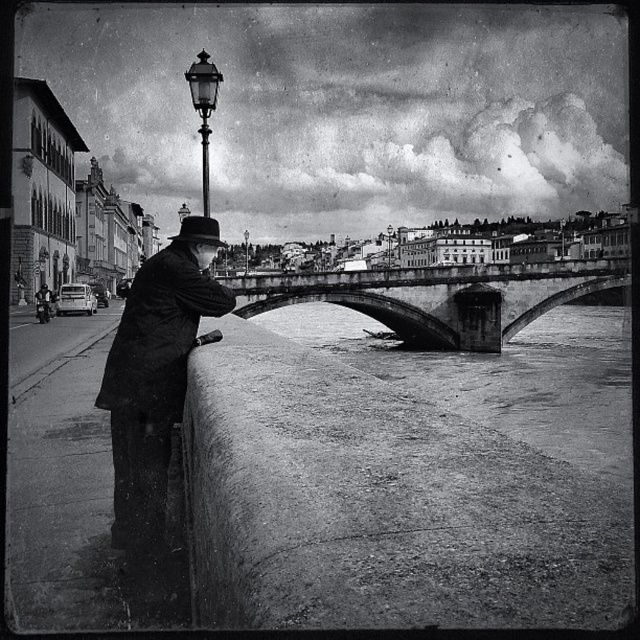
Is dark matte coat at left to the right of polished brass streetlamp at upper center from the viewer's perspective?

Indeed, dark matte coat at left is positioned on the right side of polished brass streetlamp at upper center.

Between dark matte coat at left and polished brass streetlamp at upper center, which one has more height?

Standing taller between the two is polished brass streetlamp at upper center.

Image resolution: width=640 pixels, height=640 pixels. I want to click on dark matte coat at left, so click(160, 336).

Does rough concrete river at center appear under dark matte coat at left?

Indeed, rough concrete river at center is positioned under dark matte coat at left.

Between rough concrete river at center and dark matte coat at left, which one has more height?

Standing taller between the two is rough concrete river at center.

Locate an element on the screen. The width and height of the screenshot is (640, 640). rough concrete river at center is located at coordinates (502, 376).

Who is more distant from viewer, (x=388, y=273) or (x=189, y=86)?

Positioned behind is point (x=388, y=273).

Can you confirm if concrete stone bridge at center is wider than polished brass streetlamp at upper center?

Indeed, concrete stone bridge at center has a greater width compared to polished brass streetlamp at upper center.

Locate an element on the screen. The image size is (640, 640). concrete stone bridge at center is located at coordinates (436, 296).